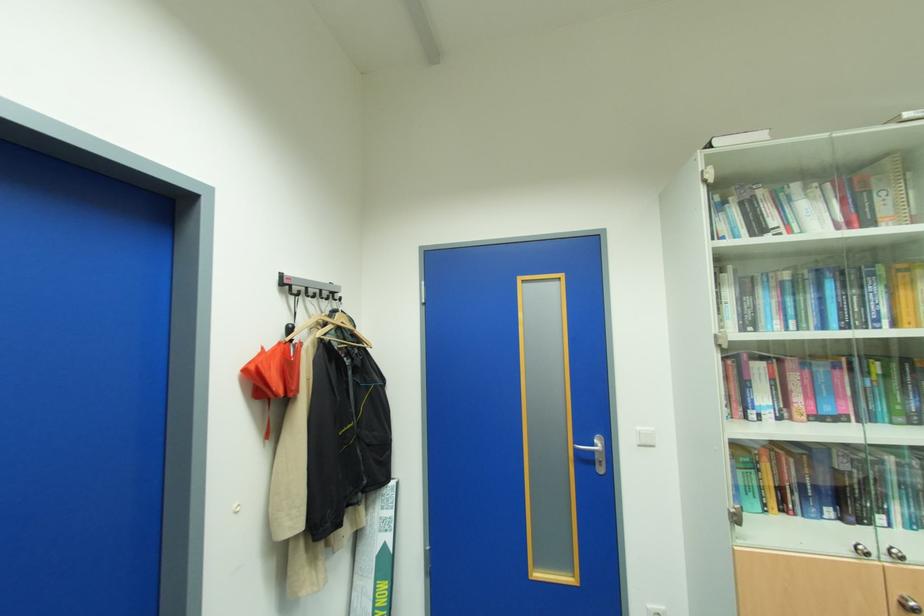
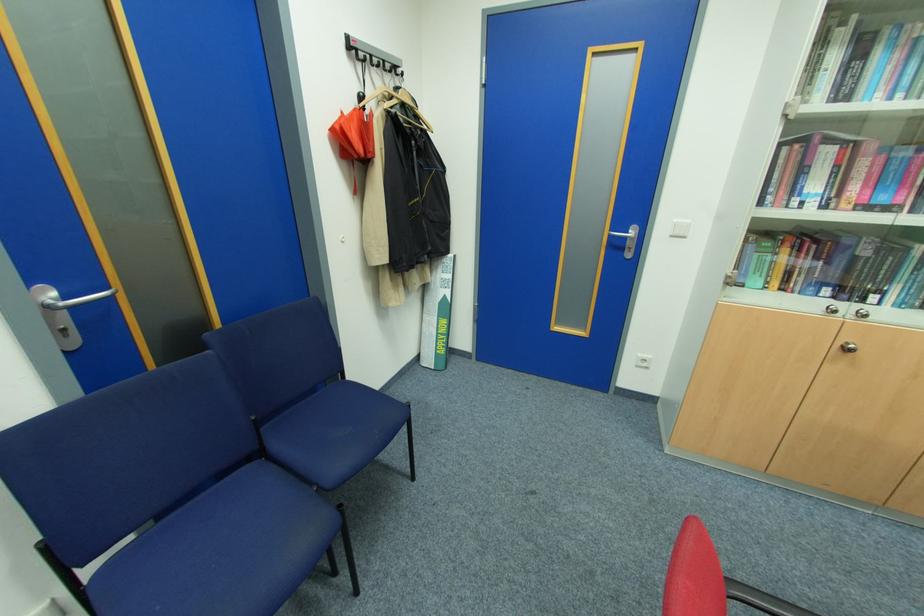
Locate, in the second image, the point that corresponds to (x=314, y=291) in the first image.

(380, 60)